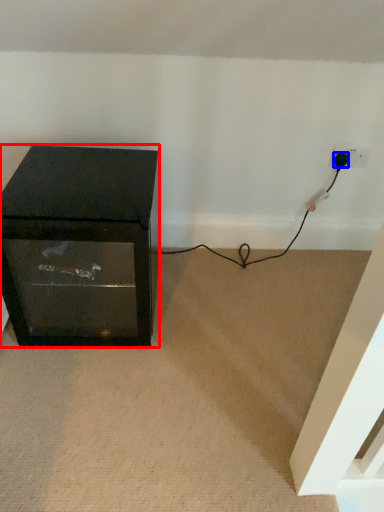
Question: Which object appears closest to the camera in this image, furniture (highlighted by a red box) or plug (highlighted by a blue box)?

Choices:
 (A) furniture
 (B) plug

Answer: (A)